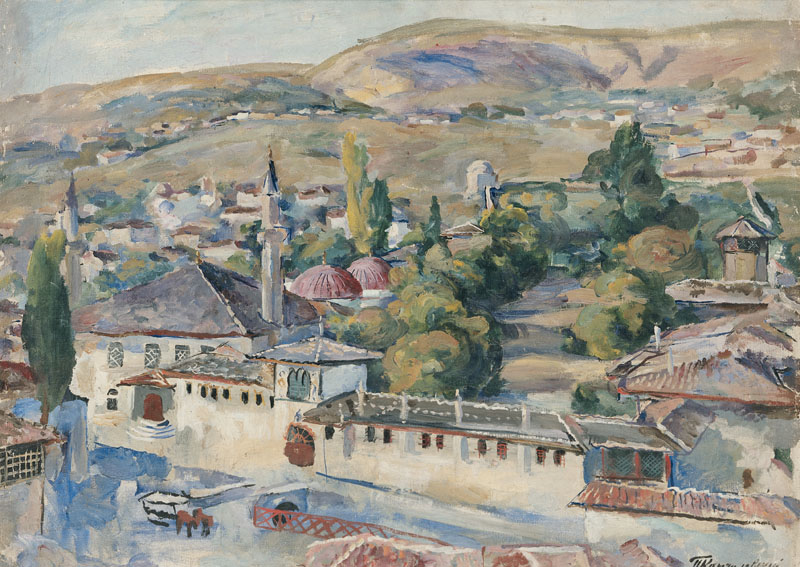
You are a GUI agent. You are given a task and a screenshot of the screen. Output one action in this format:
    pyautogui.click(x=<x>, y=<y>)
    Task: Click on the floor
    The image size is (800, 567).
    Given the screenshot: What is the action you would take?
    pyautogui.click(x=128, y=532)